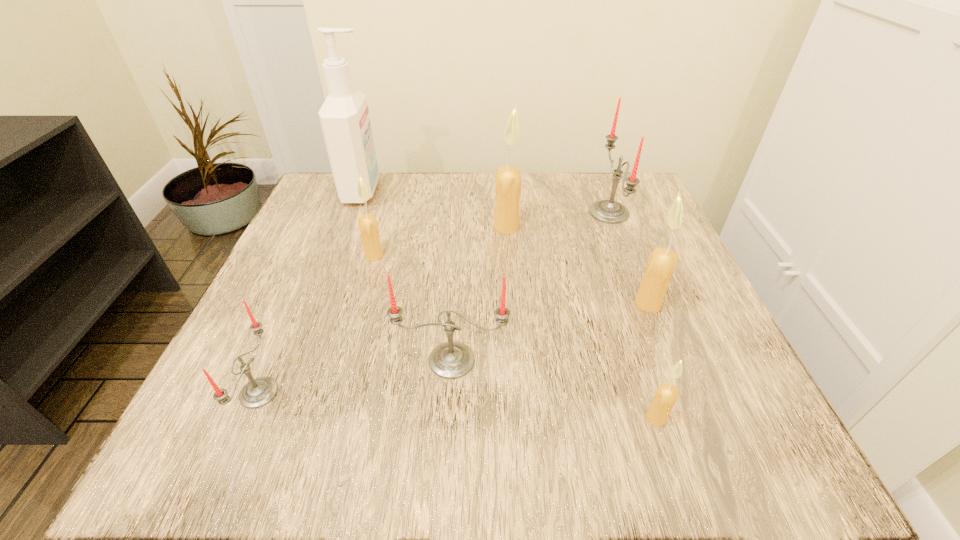
Choose which object is the third nearest neighbor to the third cream candle from right to left. Please provide its 2D coordinates. Your answer should be formatted as a tuple, i.e. [(x, y)], where the tuple contains the x and y coordinates of a point satisfying the conditions above.

[(662, 262)]

Locate an element on the screen. This screenshot has width=960, height=540. the fourth closest candle to the farthest red candle is located at coordinates (667, 394).

At what (x,y) coordinates should I click in order to perform the action: click on candle that is the fifth closest to the smallest cream candle. Please return your answer as a coordinate pair (x, y). Looking at the image, I should click on (258, 392).

The image size is (960, 540). What are the coordinates of `cream candle that is the closest to the second cream candle from left to right` in the screenshot? It's located at (x=368, y=226).

At what (x,y) coordinates should I click in order to perform the action: click on cream candle that can be found as the third closest to the nearest cream candle. Please return your answer as a coordinate pair (x, y). The image size is (960, 540). Looking at the image, I should click on (368, 226).

Identify the location of red candle that is the closest to the third cream candle from left to right. The image size is (960, 540). (451, 360).

Find the location of `the third closest red candle to the third smallest cream candle`. the third closest red candle to the third smallest cream candle is located at coordinates (258, 392).

At what (x,y) coordinates should I click in order to perform the action: click on vacant space that satisfies the following two spatial constraints: 1. on the back side of the third farthest cream candle; 2. on the front-facing side of the rightmost red candle. Please return your answer as a coordinate pair (x, y). This screenshot has width=960, height=540. Looking at the image, I should click on (612, 213).

Identify the location of free space that satisfies the following two spatial constraints: 1. on the back side of the second cream candle from left to right; 2. on the front label of the tallest object. This screenshot has width=960, height=540. click(504, 191).

Locate an element on the screen. free space that satisfies the following two spatial constraints: 1. on the front label of the cleansing agent; 2. on the back side of the sixth candle from right to left is located at coordinates (338, 255).